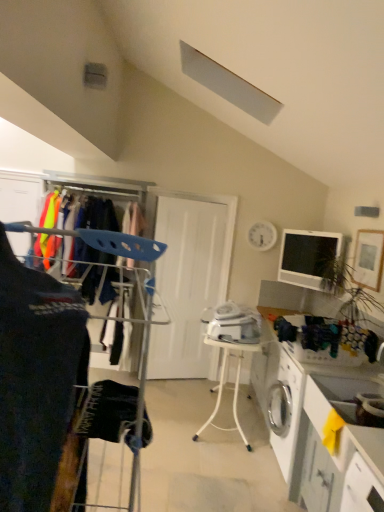
In order to click on blank space above white matte door at center (from a real-world perspective) in this screenshot , I will do `click(202, 183)`.